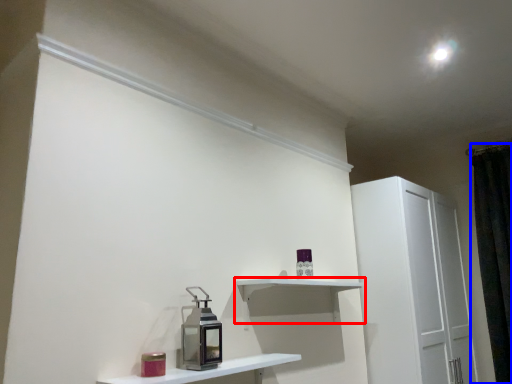
Question: Which point is further to the camera, shelf (highlighted by a red box) or curtain (highlighted by a blue box)?

Choices:
 (A) shelf
 (B) curtain

Answer: (B)